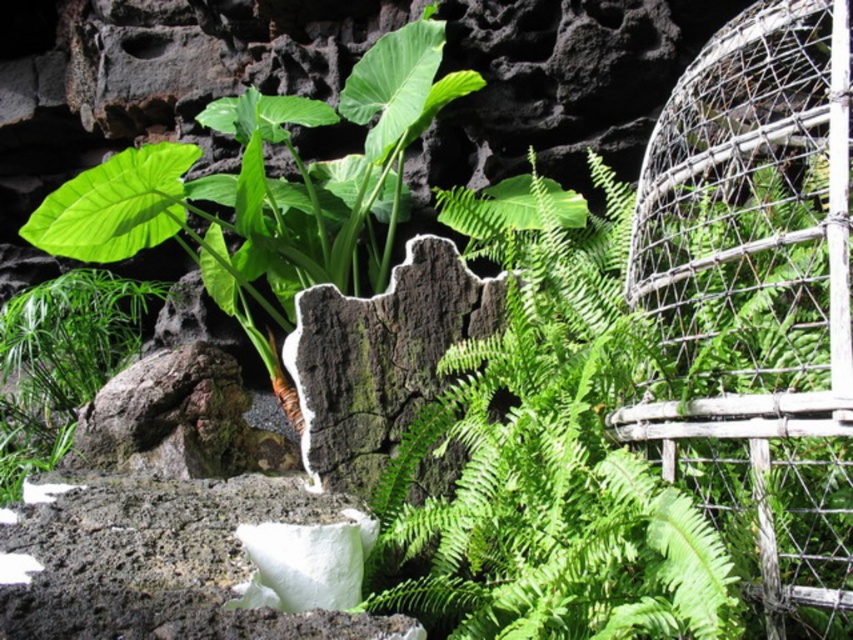
Question: Is the position of rustic wire birdcage at right more distant than that of green leafy plant at center?

Choices:
 (A) no
 (B) yes

Answer: (B)

Question: Among these points, which one is farthest from the camera?

Choices:
 (A) (20, 464)
 (B) (695, 388)

Answer: (A)

Question: Which of the following is the farthest from the observer?

Choices:
 (A) (432, 608)
 (B) (706, 481)
 (C) (3, 460)
 (D) (343, 388)

Answer: (C)

Question: Can you confirm if green leafy plant at center is positioned to the left of dark brown rough stone at center?

Choices:
 (A) yes
 (B) no

Answer: (B)

Question: Observing the image, what is the correct spatial positioning of green leafy plant at center in reference to green leafy plant at lower left?

Choices:
 (A) below
 (B) above

Answer: (A)

Question: Among these objects, which one is nearest to the camera?

Choices:
 (A) dark brown rough stone at center
 (B) green leafy plant at lower left

Answer: (A)